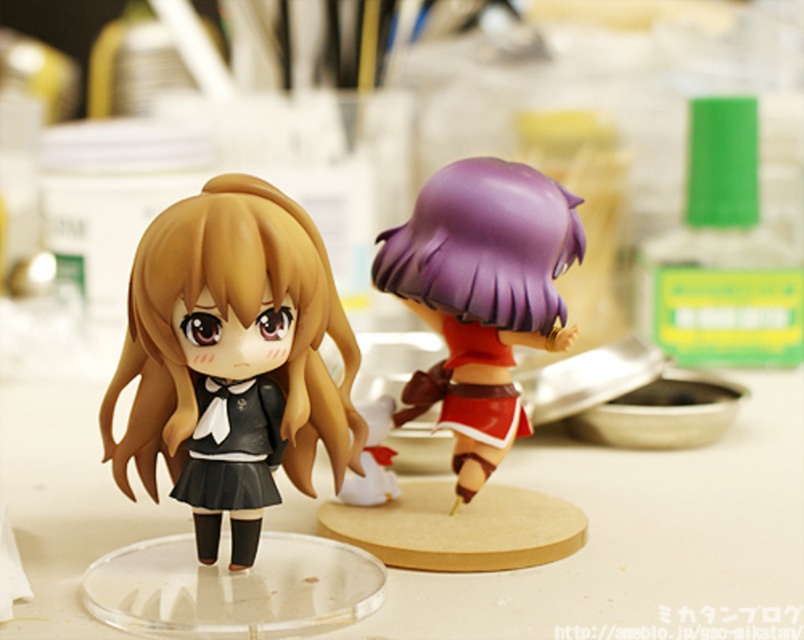
Question: Is white plastic table at center in front of purple glossy figurine at center?

Choices:
 (A) no
 (B) yes

Answer: (B)

Question: Does white plastic table at center have a greater width compared to purple glossy figurine at center?

Choices:
 (A) no
 (B) yes

Answer: (B)

Question: Which of the following is the farthest from the observer?

Choices:
 (A) white plastic table at center
 (B) matte black doll at left

Answer: (A)

Question: Is white plastic table at center in front of purple glossy figurine at center?

Choices:
 (A) yes
 (B) no

Answer: (A)

Question: Which object is farther from the camera taking this photo?

Choices:
 (A) matte black doll at left
 (B) white plastic table at center

Answer: (B)

Question: Which point is farther to the camera?

Choices:
 (A) (269, 275)
 (B) (35, 484)
 (C) (527, 216)

Answer: (B)